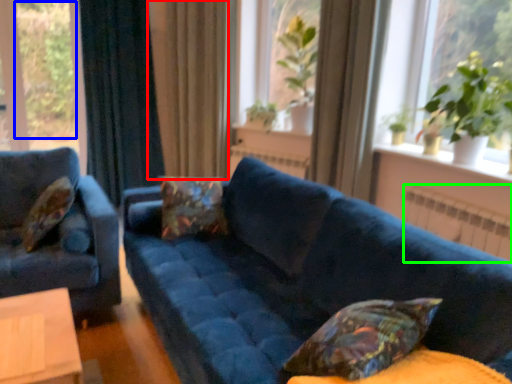
Question: Which object is the farthest from curtain (highlighted by a red box)? Choose among these: plant (highlighted by a blue box) or radiator (highlighted by a green box).

Choices:
 (A) plant
 (B) radiator

Answer: (A)